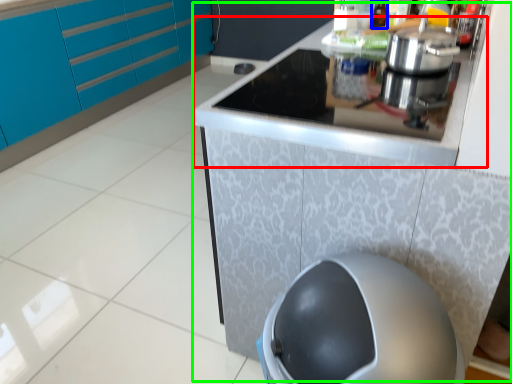
Question: Which object is positioned farthest from counter top (highlighted by a red box)? Select from bottle (highlighted by a blue box) and counter (highlighted by a green box).

Choices:
 (A) bottle
 (B) counter

Answer: (A)